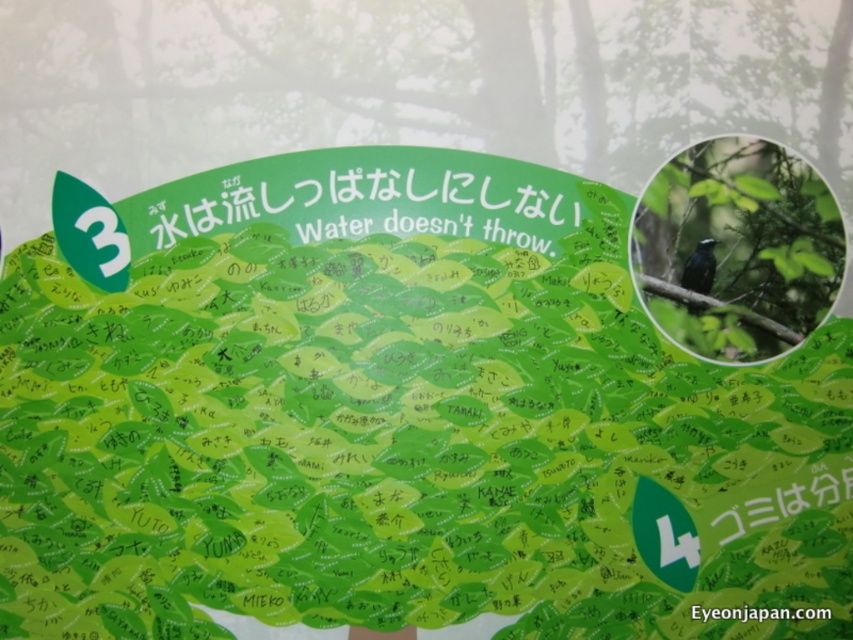
Question: Is green leafy tree at upper right wider than shiny black bird at upper right?

Choices:
 (A) yes
 (B) no

Answer: (A)

Question: Where is green leafy tree at upper right located in relation to shiny black bird at upper right in the image?

Choices:
 (A) left
 (B) right

Answer: (A)

Question: Among these points, which one is nearest to the camera?

Choices:
 (A) (688, 268)
 (B) (428, 60)

Answer: (B)

Question: Which object appears closest to the camera in this image?

Choices:
 (A) shiny black bird at upper right
 (B) green leafy tree at upper right

Answer: (B)

Question: Does green leafy tree at upper right have a greater width compared to shiny black bird at upper right?

Choices:
 (A) yes
 (B) no

Answer: (A)